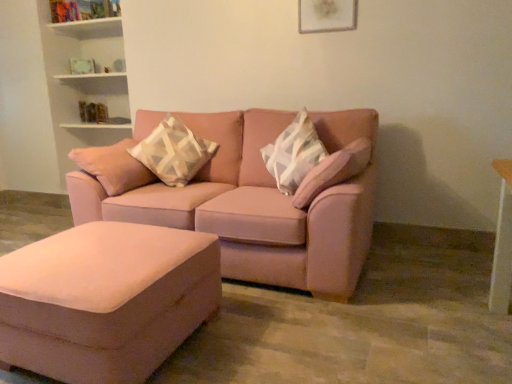
Image resolution: width=512 pixels, height=384 pixels. What do you see at coordinates (106, 300) in the screenshot? I see `suede ottoman at lower left` at bounding box center [106, 300].

The width and height of the screenshot is (512, 384). What do you see at coordinates (248, 198) in the screenshot?
I see `matte pink couch at center` at bounding box center [248, 198].

Measure the distance between point (347, 8) and camera.

9.41 feet.

At what (x,y) coordinates should I click in order to perform the action: click on suede ottoman at lower left. Please return your answer as a coordinate pair (x, y). Looking at the image, I should click on (106, 300).

Does point (339, 161) come farther from viewer compared to point (175, 161)?

No, (339, 161) is in front of (175, 161).

Where is `studio couch that is below the geometric-patterned fabric pillow at center (from the image's perspective)`? The image size is (512, 384). studio couch that is below the geometric-patterned fabric pillow at center (from the image's perspective) is located at coordinates (248, 198).

Is matte pink couch at center surrounding geometric-patterned fabric pillow at center?

Yes, geometric-patterned fabric pillow at center is a part of matte pink couch at center.

From the image's perspective, relative to geometric-patterned fabric pillow at center, is matte pink couch at center above or below?

matte pink couch at center is situated lower than geometric-patterned fabric pillow at center in the image.

Is point (333, 11) farther from camera compared to point (149, 136)?

No, (333, 11) is closer to viewer.

Considering the sizes of objects matte white picture frame at upper center and geometric-patterned fabric pillow at center in the image provided, who is bigger, matte white picture frame at upper center or geometric-patterned fabric pillow at center?

With larger size is geometric-patterned fabric pillow at center.

How different are the orientations of matte white picture frame at upper center and geometric-patterned fabric pillow at center in degrees?

36.9 degrees separate the facing orientations of matte white picture frame at upper center and geometric-patterned fabric pillow at center.

You are a GUI agent. You are given a task and a screenshot of the screen. Output one action in this format:
    pyautogui.click(x=<x>, y=<y>)
    Task: Click on the table in front of the geometric-patterned fabric pillow at center
    The height and width of the screenshot is (384, 512).
    Given the screenshot: What is the action you would take?
    pyautogui.click(x=106, y=300)

Can you tell me how much geometric-patterned fabric pillow at center and suede ottoman at lower left differ in facing direction?

They differ by 37 degrees in their facing directions.

Is geometric-patterned fabric pillow at center aimed at suede ottoman at lower left?

Yes, geometric-patterned fabric pillow at center is aimed at suede ottoman at lower left.

Is geometric-patterned fabric pillow at center to the left of matte pink couch at center from the viewer's perspective?

Correct, you'll find geometric-patterned fabric pillow at center to the left of matte pink couch at center.

Considering the positions of points (150, 152) and (337, 207), is point (150, 152) farther from camera compared to point (337, 207)?

Yes, point (150, 152) is farther from viewer.

From a real-world perspective, is geometric-patterned fabric pillow at center positioned under matte pink couch at center based on gravity?

No.

Considering the positions of objects suede ottoman at lower left and matte white picture frame at upper center in the image provided, who is more to the left, suede ottoman at lower left or matte white picture frame at upper center?

Positioned to the left is suede ottoman at lower left.

Which is correct: suede ottoman at lower left is inside matte white picture frame at upper center, or outside of it?

suede ottoman at lower left is outside matte white picture frame at upper center.

Considering the relative positions of matte white picture frame at upper center and suede ottoman at lower left in the image provided, is matte white picture frame at upper center to the right of suede ottoman at lower left from the viewer's perspective?

Indeed, matte white picture frame at upper center is positioned on the right side of suede ottoman at lower left.

Considering the sizes of objects matte white picture frame at upper center and suede ottoman at lower left in the image provided, who is thinner, matte white picture frame at upper center or suede ottoman at lower left?

matte white picture frame at upper center.

Does matte white picture frame at upper center have a lesser height compared to suede ottoman at lower left?

Correct, matte white picture frame at upper center is not as tall as suede ottoman at lower left.

From a real-world perspective, is suede ottoman at lower left positioned above or below matte pink couch at center?

Clearly, from a real-world perspective, suede ottoman at lower left is below matte pink couch at center.

Would you say matte pink couch at center is part of suede ottoman at lower left's contents?

That's incorrect, matte pink couch at center is not inside suede ottoman at lower left.

Does suede ottoman at lower left have a greater height compared to matte pink couch at center?

Incorrect, the height of suede ottoman at lower left is not larger of that of matte pink couch at center.

Considering the sizes of suede ottoman at lower left and matte pink couch at center in the image, is suede ottoman at lower left wider or thinner than matte pink couch at center?

suede ottoman at lower left is thinner than matte pink couch at center.

At what (x,y) coordinates should I click in order to perform the action: click on studio couch below the geometric-patterned fabric pillow at center (from a real-world perspective). Please return your answer as a coordinate pair (x, y). The width and height of the screenshot is (512, 384). Looking at the image, I should click on (248, 198).

Where is `pillow below the matte white picture frame at upper center (from the image's perspective)`? This screenshot has height=384, width=512. pillow below the matte white picture frame at upper center (from the image's perspective) is located at coordinates (173, 152).

Considering their positions, is suede ottoman at lower left positioned closer to geometric-patterned fabric pillow at center than matte white picture frame at upper center?

suede ottoman at lower left is closer to geometric-patterned fabric pillow at center.

From the image, which object appears to be nearer to matte pink couch at center, matte white picture frame at upper center or geometric-patterned fabric pillow at center?

The object closer to matte pink couch at center is geometric-patterned fabric pillow at center.

Considering their positions, is suede ottoman at lower left positioned further to matte white picture frame at upper center than geometric-patterned fabric pillow at center?

Among the two, suede ottoman at lower left is located further to matte white picture frame at upper center.

Estimate the real-world distances between objects in this image. Which object is closer to suede ottoman at lower left, matte pink couch at center or geometric-patterned fabric pillow at center?

Among the two, matte pink couch at center is located nearer to suede ottoman at lower left.

Based on their spatial positions, is suede ottoman at lower left or matte pink couch at center further from matte white picture frame at upper center?

Among the two, suede ottoman at lower left is located further to matte white picture frame at upper center.

Estimate the real-world distances between objects in this image. Which object is closer to matte white picture frame at upper center, matte pink couch at center or suede ottoman at lower left?

matte pink couch at center.

Looking at the image, which one is located closer to matte pink couch at center, suede ottoman at lower left or geometric-patterned fabric pillow at center?

geometric-patterned fabric pillow at center.

Based on their spatial positions, is matte pink couch at center or matte white picture frame at upper center further from geometric-patterned fabric pillow at center?

matte white picture frame at upper center.

Find the location of a particular element. The height and width of the screenshot is (384, 512). studio couch between matte white picture frame at upper center and suede ottoman at lower left in the up-down direction is located at coordinates (248, 198).

This screenshot has width=512, height=384. I want to click on studio couch located between suede ottoman at lower left and geometric-patterned fabric pillow at center in the depth direction, so click(x=248, y=198).

Find the location of `pillow that lies between matte white picture frame at upper center and matte pink couch at center from top to bottom`. pillow that lies between matte white picture frame at upper center and matte pink couch at center from top to bottom is located at coordinates (173, 152).

This screenshot has height=384, width=512. Identify the location of pillow between matte white picture frame at upper center and suede ottoman at lower left in the vertical direction. (173, 152).